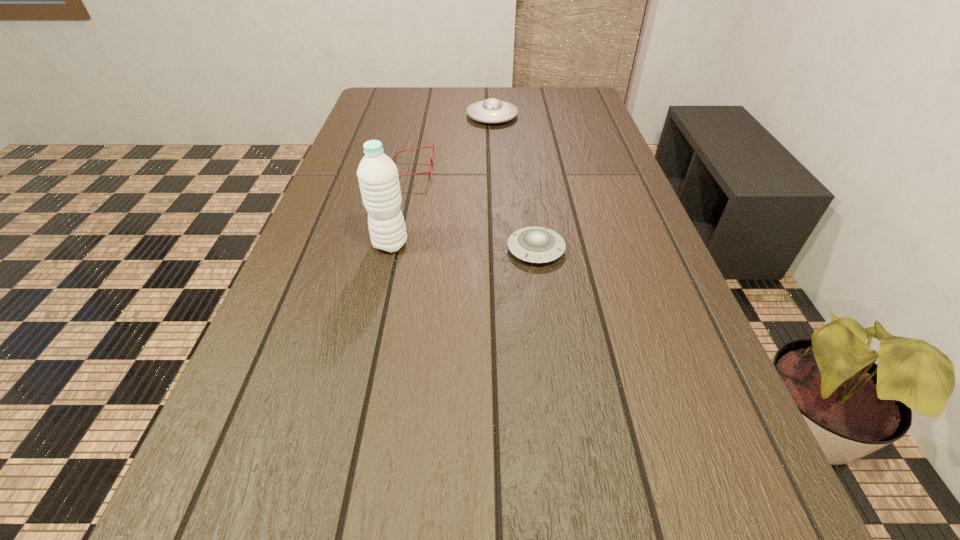
The image size is (960, 540). What are the coordinates of `vacant area that lies between the spectacles and the shortest object` in the screenshot? It's located at (473, 211).

Locate an element on the screen. free spot between the tallest object and the farthest object is located at coordinates (442, 180).

What are the coordinates of `vacant region between the nearer saucer and the farthest object` in the screenshot? It's located at (514, 183).

Identify the location of free space between the tallest object and the shorter saucer. The image size is (960, 540). (463, 247).

I want to click on free spot between the farther saucer and the shorter saucer, so click(x=514, y=183).

Locate which object is the second closest to the nearer saucer. Please provide its 2D coordinates. Your answer should be formatted as a tuple, i.e. [(x, y)], where the tuple contains the x and y coordinates of a point satisfying the conditions above.

[(432, 162)]

Identify the location of object that is the nearest to the farther saucer. (432, 162).

You are a GUI agent. You are given a task and a screenshot of the screen. Output one action in this format:
    pyautogui.click(x=<x>, y=<y>)
    Task: Click on the free space in the image that satisfies the following two spatial constraints: 1. on the face of the shorter saucer; 2. on the right side of the spectacles
    The image size is (960, 540).
    Given the screenshot: What is the action you would take?
    pyautogui.click(x=395, y=249)